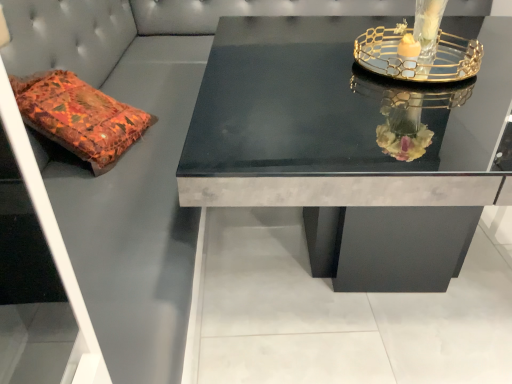
Question: Does black marble table at center have a greater height compared to clear glass candle holder at upper right?

Choices:
 (A) no
 (B) yes

Answer: (B)

Question: Is black marble table at center aimed at clear glass candle holder at upper right?

Choices:
 (A) no
 (B) yes

Answer: (A)

Question: Is black marble table at center positioned beyond the bounds of clear glass candle holder at upper right?

Choices:
 (A) no
 (B) yes

Answer: (B)

Question: From a real-world perspective, is black marble table at center positioned under clear glass candle holder at upper right based on gravity?

Choices:
 (A) yes
 (B) no

Answer: (A)

Question: Is black marble table at center positioned with its back to clear glass candle holder at upper right?

Choices:
 (A) yes
 (B) no

Answer: (B)

Question: Does black marble table at center have a larger size compared to clear glass candle holder at upper right?

Choices:
 (A) yes
 (B) no

Answer: (A)

Question: From a real-world perspective, is clear glass candle holder at upper right under black marble table at center?

Choices:
 (A) no
 (B) yes

Answer: (A)

Question: Can you confirm if clear glass candle holder at upper right is positioned to the left of black marble table at center?

Choices:
 (A) yes
 (B) no

Answer: (B)

Question: Can you confirm if clear glass candle holder at upper right is thinner than black marble table at center?

Choices:
 (A) yes
 (B) no

Answer: (A)

Question: Does clear glass candle holder at upper right have a lesser height compared to black marble table at center?

Choices:
 (A) yes
 (B) no

Answer: (A)

Question: Would you say clear glass candle holder at upper right contains black marble table at center?

Choices:
 (A) yes
 (B) no

Answer: (B)

Question: Is clear glass candle holder at upper right not near black marble table at center?

Choices:
 (A) yes
 (B) no

Answer: (B)

Question: Looking at the image, does clear glass candle holder at upper right seem bigger or smaller compared to black marble table at center?

Choices:
 (A) big
 (B) small

Answer: (B)